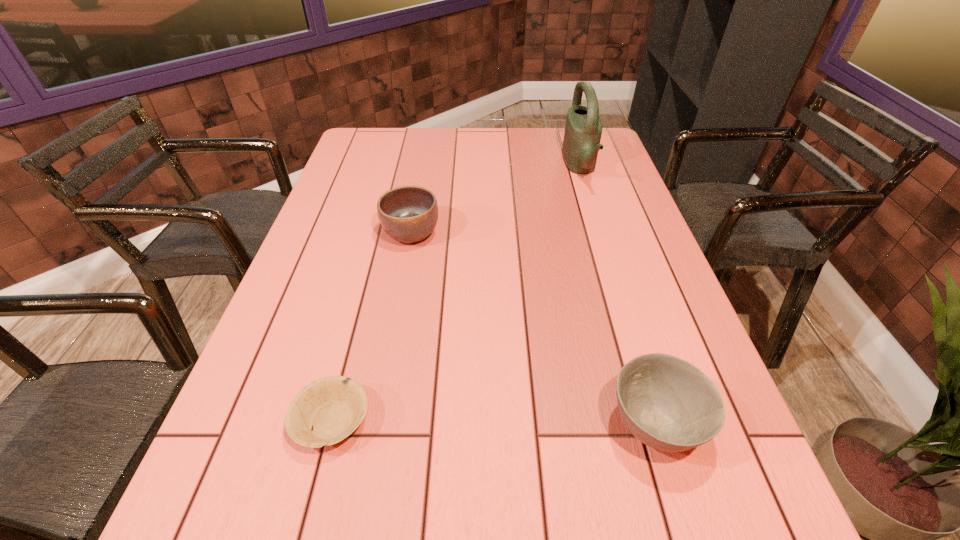
Locate an element on the screen. The width and height of the screenshot is (960, 540). vacant region at the near right corner is located at coordinates (720, 531).

Where is `unoccupied area between the shortest bowl and the tallest object`? Image resolution: width=960 pixels, height=540 pixels. unoccupied area between the shortest bowl and the tallest object is located at coordinates (456, 293).

Where is `vacant area that lies between the shortest object and the watering can`? vacant area that lies between the shortest object and the watering can is located at coordinates (456, 293).

The width and height of the screenshot is (960, 540). In order to click on free space between the tallest object and the third nearest object in this screenshot , I will do `click(495, 200)`.

Locate an element on the screen. Image resolution: width=960 pixels, height=540 pixels. free space between the rightmost bowl and the farthest bowl is located at coordinates (533, 329).

Where is `vacant area that lies between the shortest bowl and the watering can`? The width and height of the screenshot is (960, 540). vacant area that lies between the shortest bowl and the watering can is located at coordinates (456, 293).

Image resolution: width=960 pixels, height=540 pixels. Identify the location of unoccupied position between the shortest bowl and the third nearest object. (372, 327).

Locate an element on the screen. vacant space that is in between the rightmost bowl and the farthest object is located at coordinates (617, 296).

Image resolution: width=960 pixels, height=540 pixels. I want to click on unoccupied position between the rightmost bowl and the second farthest object, so click(x=533, y=329).

In order to click on empty space that is in between the rightmost bowl and the watering can in this screenshot , I will do `click(617, 296)`.